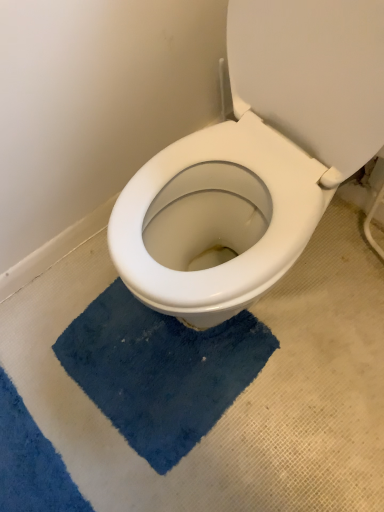
The width and height of the screenshot is (384, 512). I want to click on vacant area on top of blue plush bath mat at center (from a real-world perspective), so click(152, 355).